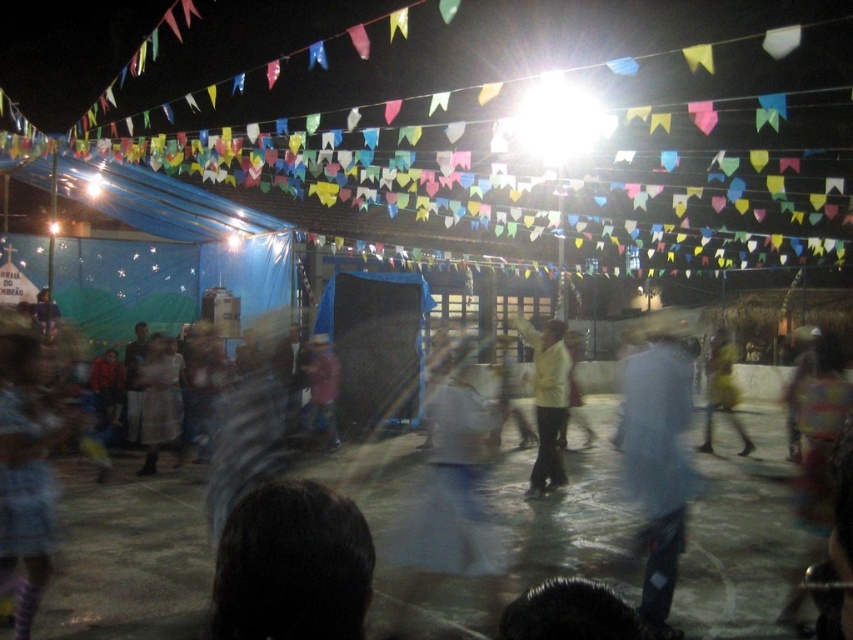
Question: Estimate the real-world distances between objects in this image. Which object is closer to the yellow fabric at center?

Choices:
 (A) matte white dress at center
 (B) light blue fabric at center
 (C) reddish-brown fabric at center
 (D) white matte shirt at center

Answer: (B)

Question: Does white matte shirt at center have a lesser width compared to matte white dress at center?

Choices:
 (A) no
 (B) yes

Answer: (A)

Question: Which of these objects is positioned farthest from the reddish-brown fabric at center?

Choices:
 (A) light blue fabric at center
 (B) yellow fabric at center
 (C) matte white dress at center

Answer: (B)

Question: Does reddish-brown fabric at center lie in front of yellow fabric at center?

Choices:
 (A) yes
 (B) no

Answer: (A)

Question: Which of the following is the farthest from the observer?

Choices:
 (A) (329, 445)
 (B) (711, 381)

Answer: (B)

Question: Can you confirm if light blue fabric at center is wider than white matte shirt at center?

Choices:
 (A) yes
 (B) no

Answer: (A)